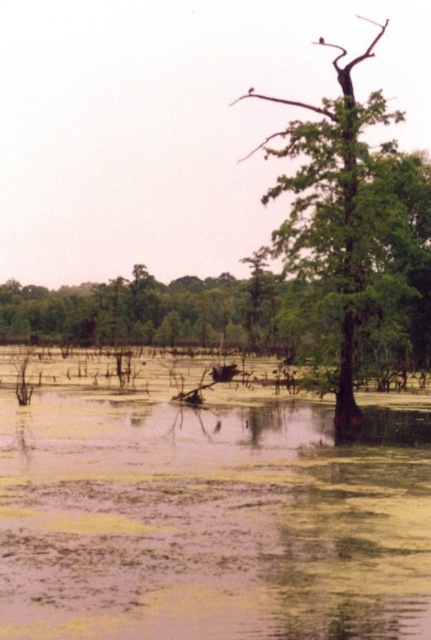
Question: Does green algae-covered water at center have a lesser width compared to green matte tree at upper right?

Choices:
 (A) yes
 (B) no

Answer: (A)

Question: Is green algae-covered water at center to the right of green matte tree at upper right from the viewer's perspective?

Choices:
 (A) no
 (B) yes

Answer: (A)

Question: Which object is farther from the camera taking this photo?

Choices:
 (A) green matte tree at upper right
 (B) green algae-covered water at center

Answer: (A)

Question: Which object appears farthest from the camera in this image?

Choices:
 (A) green matte tree at upper right
 (B) green algae-covered water at center

Answer: (A)

Question: Which of the following is the farthest from the observer?

Choices:
 (A) (399, 461)
 (B) (425, 221)

Answer: (B)

Question: Where is green algae-covered water at center located in relation to green matte tree at upper right in the image?

Choices:
 (A) right
 (B) left

Answer: (B)